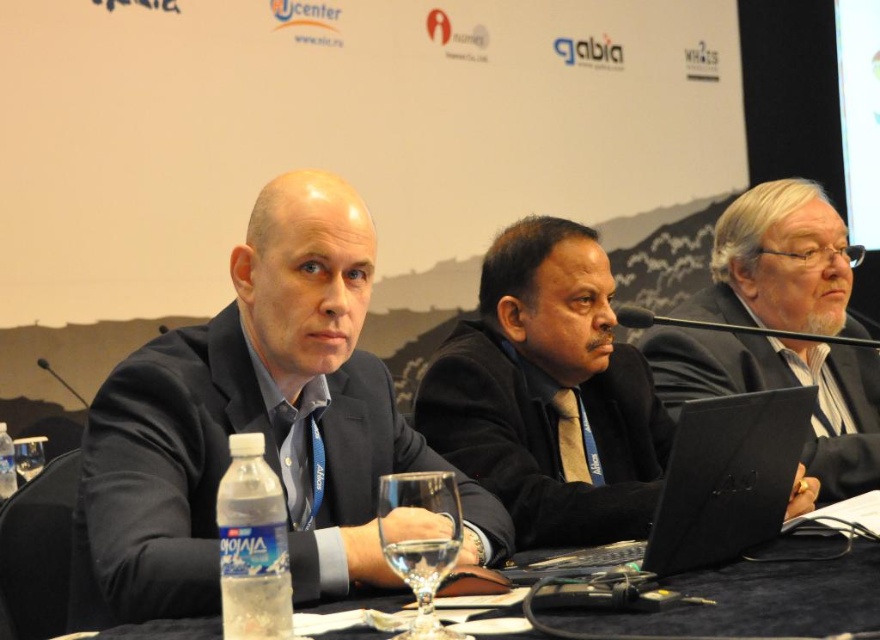
You are an event organizer arranging seating for a panel discussion. You need to place a name tag on the table in front of each speaker. The name tags must be placed in order from closest to farthest from the audience. Given the current arrangement of the gray matte suit at right and black matte suit at center, which speaker should have their name tag placed closer to the audience?

The gray matte suit at right should have their name tag placed closer to the audience because the black matte suit at center is behind them, making the gray matte suit at right closer to the front.

You are an event organizer arranging seating for a panel discussion. You need to place a name tag on the table in front of the gray matte suit at right and the black matte suit at center. Based on their positions, which name tag should be placed closer to the front of the table?

The gray matte suit at right is above the black matte suit at center, so the name tag for the gray matte suit at right should be placed closer to the front of the table.